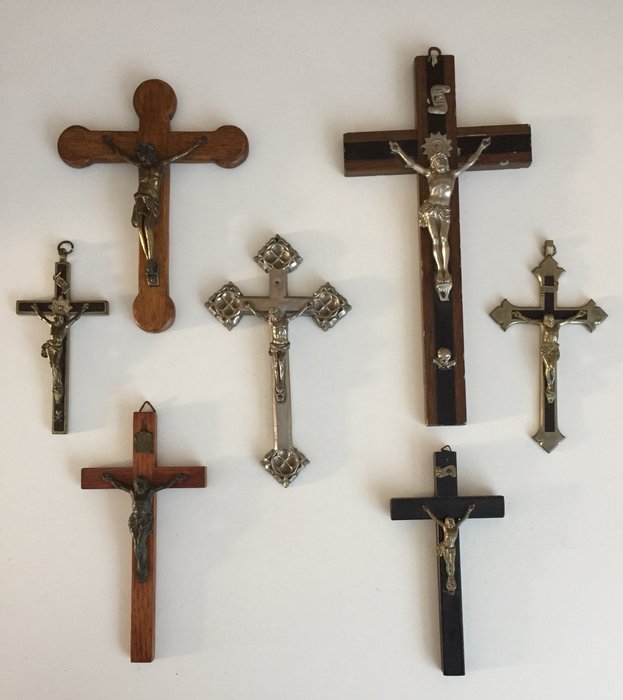
What are the coordinates of `wall` in the screenshot? It's located at (354, 258).